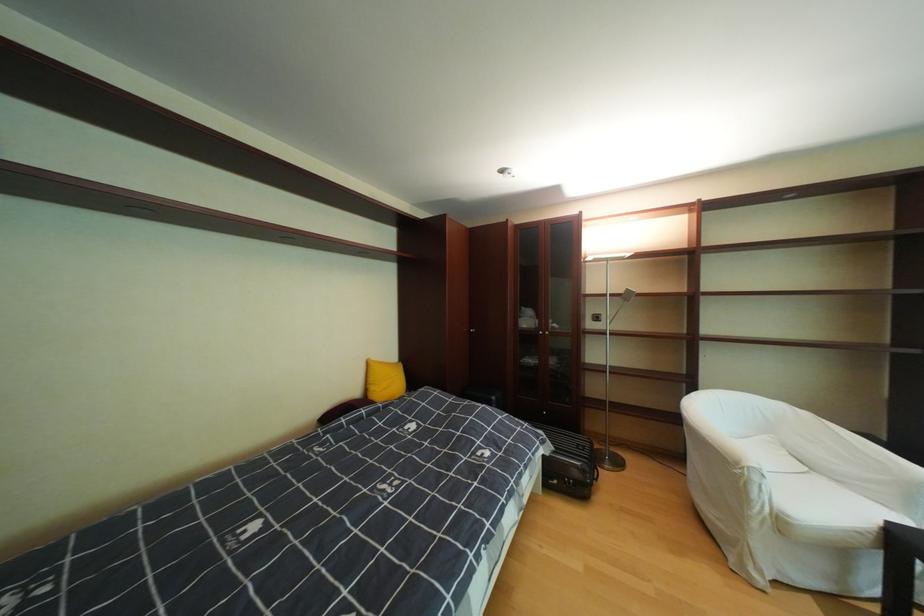
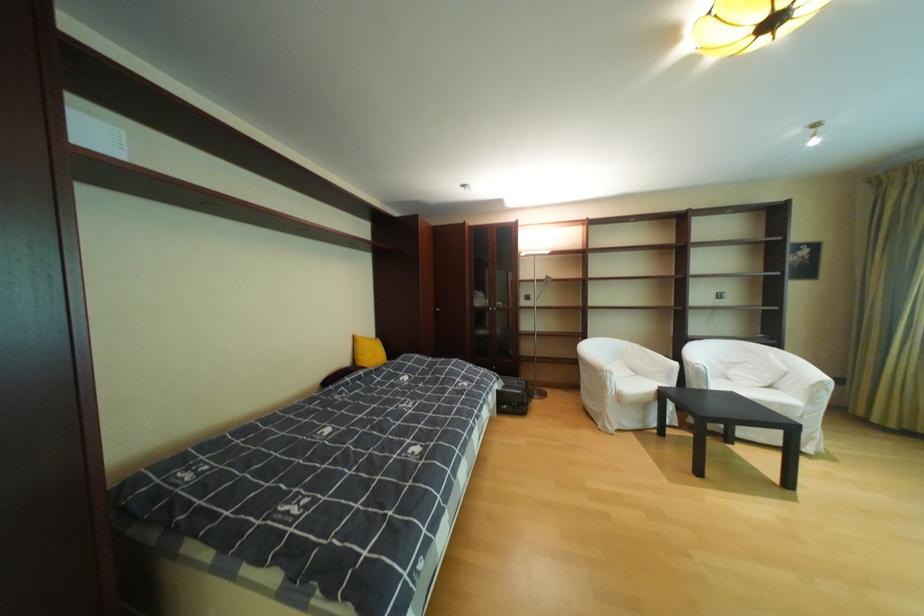
Find the pixel in the second image that matches (768,479) in the first image.

(621, 377)